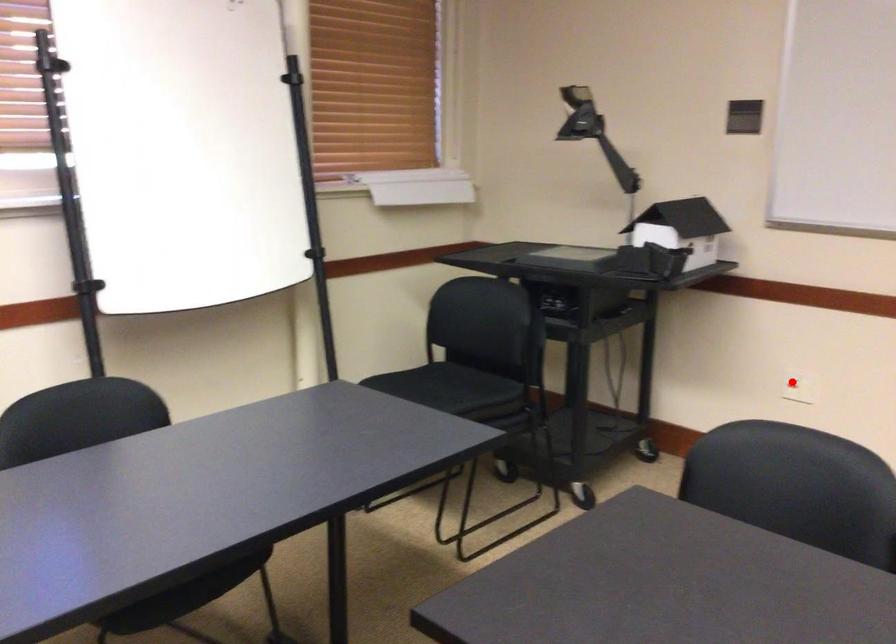
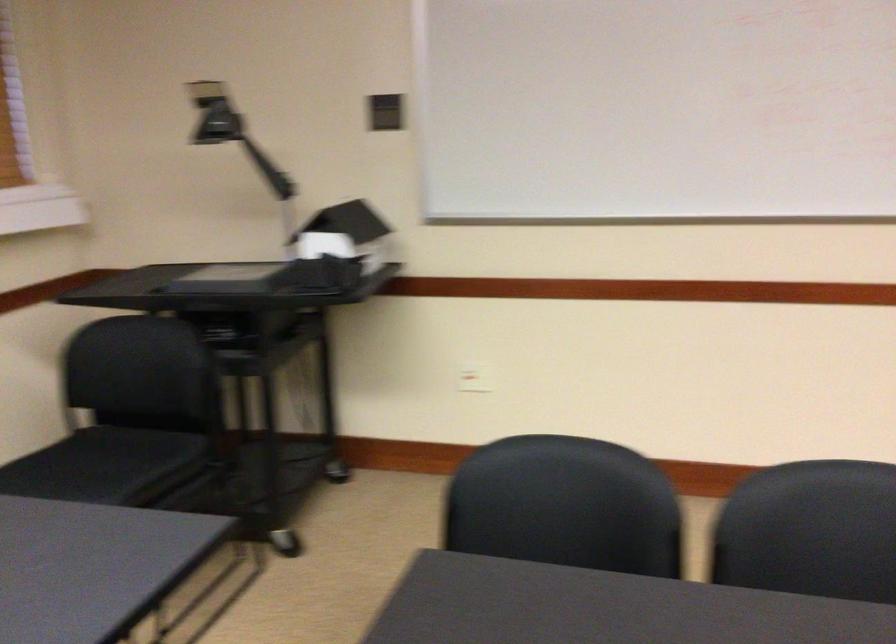
Locate, in the second image, the point that corresponds to the highlighted location in the first image.

(474, 377)